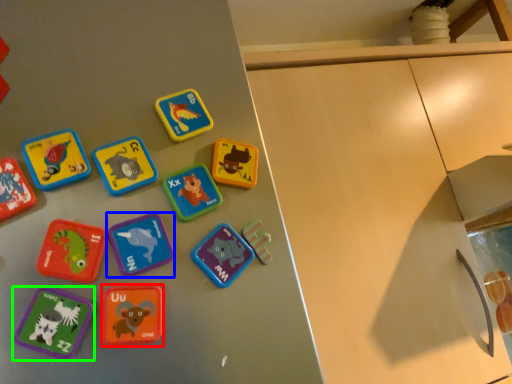
Question: Based on their relative distances, which object is nearer to toy (highlighted by a red box)? Choose from toy (highlighted by a blue box) and toy (highlighted by a green box).

Choices:
 (A) toy
 (B) toy

Answer: (B)